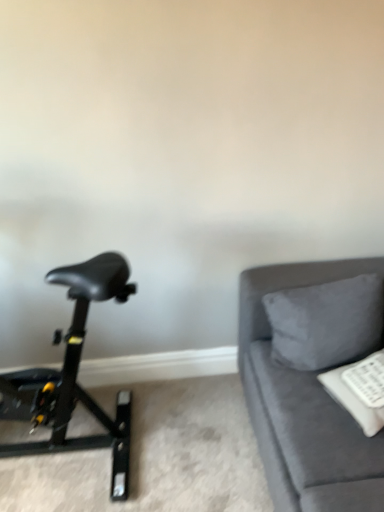
Question: Is suede gray pillow at right completely or partially inside velvet gray couch at right?

Choices:
 (A) yes
 (B) no

Answer: (A)

Question: Are velvet gray couch at right and suede gray pillow at right beside each other?

Choices:
 (A) yes
 (B) no

Answer: (B)

Question: Is velvet gray couch at right to the left of suede gray pillow at right from the viewer's perspective?

Choices:
 (A) no
 (B) yes

Answer: (A)

Question: From the image's perspective, would you say velvet gray couch at right is positioned over suede gray pillow at right?

Choices:
 (A) no
 (B) yes

Answer: (A)

Question: Can you confirm if velvet gray couch at right is wider than suede gray pillow at right?

Choices:
 (A) no
 (B) yes

Answer: (B)

Question: Is point (352, 478) closer or farther from the camera than point (360, 310)?

Choices:
 (A) closer
 (B) farther

Answer: (A)

Question: In terms of size, does velvet gray couch at right appear bigger or smaller than suede gray pillow at right?

Choices:
 (A) big
 (B) small

Answer: (A)

Question: Is velvet gray couch at right situated inside suede gray pillow at right or outside?

Choices:
 (A) outside
 (B) inside

Answer: (A)

Question: In terms of height, does velvet gray couch at right look taller or shorter compared to suede gray pillow at right?

Choices:
 (A) short
 (B) tall

Answer: (B)

Question: Is black matte stationary bicycle at left inside or outside of velvet gray couch at right?

Choices:
 (A) outside
 (B) inside

Answer: (A)

Question: From the image's perspective, relative to velvet gray couch at right, is black matte stationary bicycle at left above or below?

Choices:
 (A) below
 (B) above

Answer: (B)

Question: Looking at their shapes, would you say black matte stationary bicycle at left is wider or thinner than velvet gray couch at right?

Choices:
 (A) thin
 (B) wide

Answer: (A)

Question: Is black matte stationary bicycle at left bigger or smaller than velvet gray couch at right?

Choices:
 (A) small
 (B) big

Answer: (A)

Question: Based on their positions, is black matte stationary bicycle at left located to the left or right of suede gray pillow at right?

Choices:
 (A) right
 (B) left

Answer: (B)

Question: Considering the positions of black matte stationary bicycle at left and suede gray pillow at right in the image, is black matte stationary bicycle at left taller or shorter than suede gray pillow at right?

Choices:
 (A) short
 (B) tall

Answer: (B)